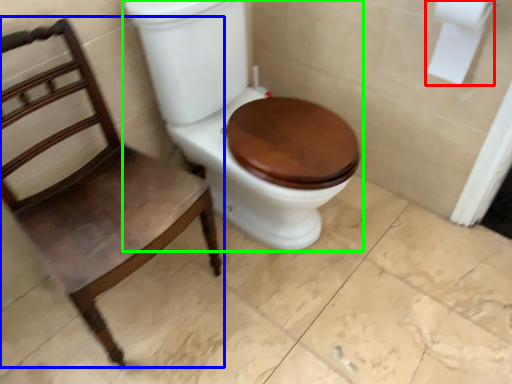
Question: Which is nearer to the toilet paper (highlighted by a red box)? chair (highlighted by a blue box) or toilet (highlighted by a green box).

Choices:
 (A) chair
 (B) toilet

Answer: (B)